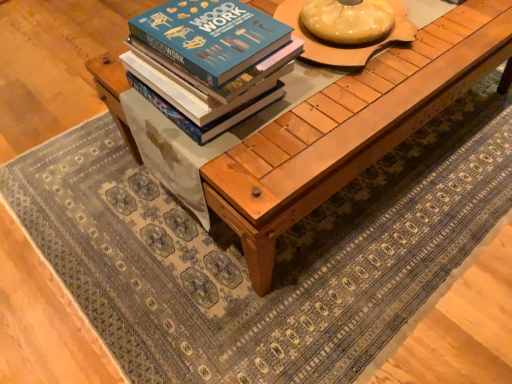
Question: Is point (330, 49) closer or farther from the camera than point (197, 112)?

Choices:
 (A) closer
 (B) farther

Answer: (B)

Question: Would you say matte wooden round table at center is inside or outside blue matte book at center?

Choices:
 (A) inside
 (B) outside

Answer: (B)

Question: Estimate the real-world distances between objects in this image. Which object is farther from the natural wood table at center?

Choices:
 (A) matte wooden round table at center
 (B) blue matte book at center

Answer: (B)

Question: Estimate the real-world distances between objects in this image. Which object is closer to the blue matte book at center?

Choices:
 (A) natural wood table at center
 (B) matte wooden round table at center

Answer: (A)